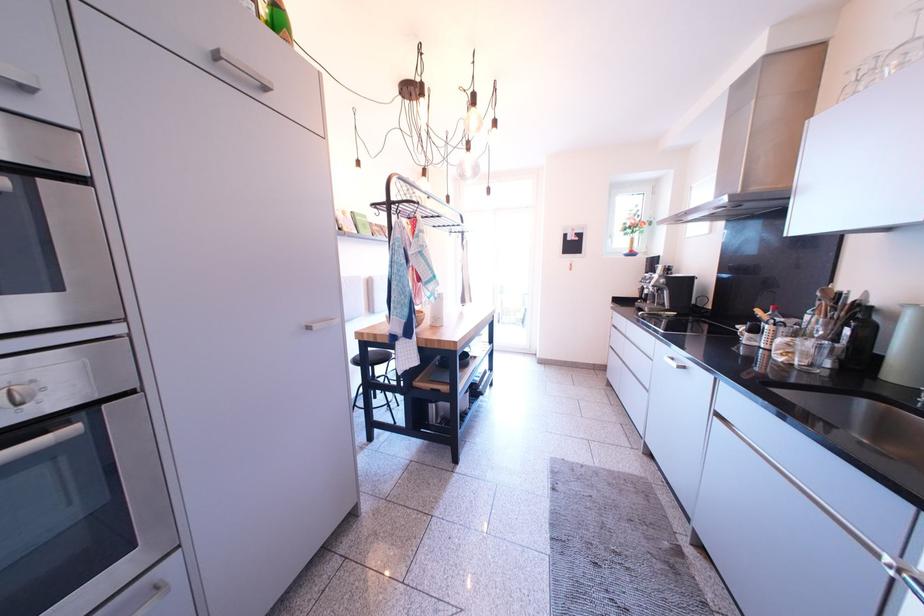
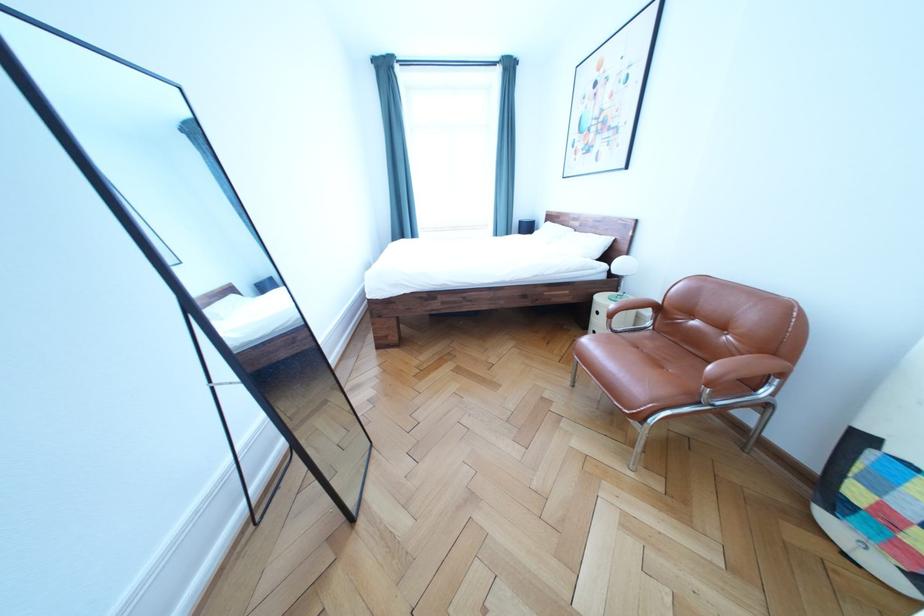
Question: Which direction would the cameraman need to move to produce the second image? Reply with the corresponding letter.

Choices:
 (A) Left
 (B) Right
 (C) Forward
 (D) Backward

Answer: (A)